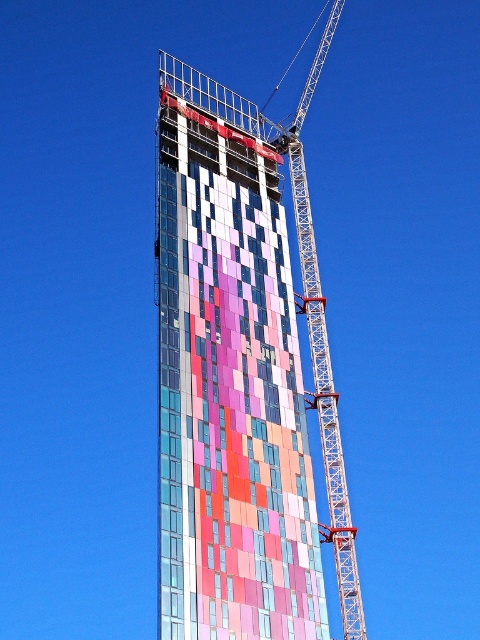
Question: Can you confirm if multicolored glass facade at center is smaller than metallic lattice crane at center?

Choices:
 (A) yes
 (B) no

Answer: (B)

Question: Does multicolored glass facade at center have a greater width compared to metallic lattice crane at center?

Choices:
 (A) yes
 (B) no

Answer: (A)

Question: Which object is closer to the camera taking this photo?

Choices:
 (A) metallic lattice crane at center
 (B) multicolored glass facade at center

Answer: (B)

Question: Can you confirm if multicolored glass facade at center is bigger than metallic lattice crane at center?

Choices:
 (A) yes
 (B) no

Answer: (A)

Question: Which point appears closest to the camera in this image?

Choices:
 (A) (316, 58)
 (B) (201, 480)

Answer: (B)